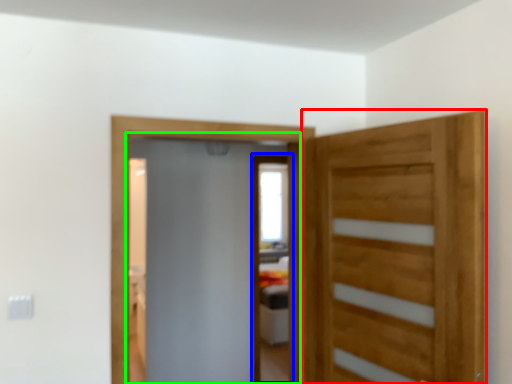
Question: Estimate the real-world distances between objects in this image. Which object is closer to door (highlighted by a red box), screen door (highlighted by a blue box) or screen door (highlighted by a green box)?

Choices:
 (A) screen door
 (B) screen door

Answer: (B)